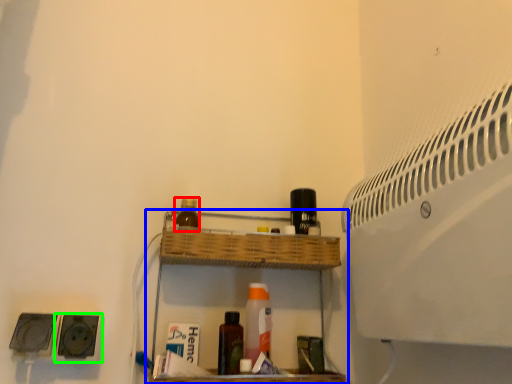
Question: Which is farther away from bottle (highlighted by a red box)? shelf (highlighted by a blue box) or speaker (highlighted by a green box)?

Choices:
 (A) shelf
 (B) speaker

Answer: (B)